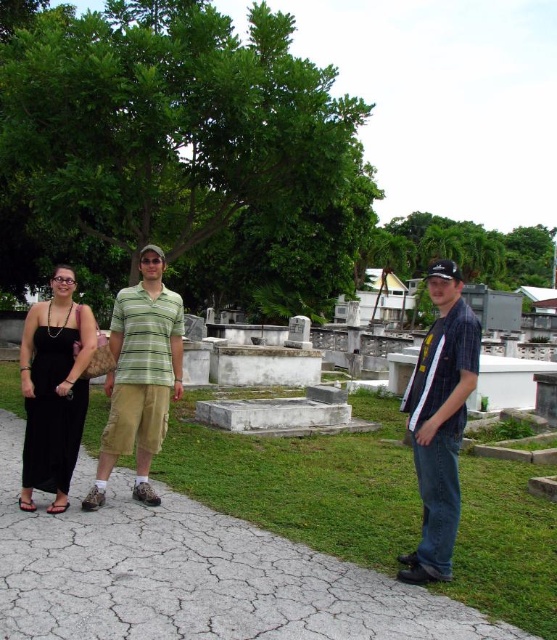
Between cracked concrete path at center and black satin dress at left, which one has more height?

black satin dress at left

Who is positioned more to the right, cracked concrete path at center or black satin dress at left?

cracked concrete path at center

This screenshot has height=640, width=557. Identify the location of cracked concrete path at center. (192, 576).

Which of these two, cracked concrete path at center or striped cotton shirt at center, stands shorter?

Standing shorter between the two is cracked concrete path at center.

Which is below, cracked concrete path at center or striped cotton shirt at center?

cracked concrete path at center is lower down.

Which is behind, point (295, 614) or point (424, 476)?

The point (424, 476) is behind.

Image resolution: width=557 pixels, height=640 pixels. What are the coordinates of `cracked concrete path at center` in the screenshot? It's located at (192, 576).

Looking at this image, which is below, green striped shirt at center or black satin dress at left?

black satin dress at left is below.

Is point (144, 250) farther from viewer compared to point (27, 371)?

Yes, point (144, 250) is farther from viewer.

Is point (155, 422) positioned after point (26, 346)?

Yes, it is.

The height and width of the screenshot is (640, 557). What are the coordinates of `green striped shirt at center` in the screenshot? It's located at (140, 376).